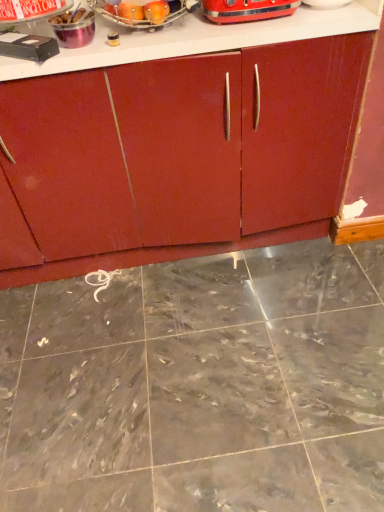
Question: From the image's perspective, relative to black plastic vcr at upper left, the 1th appliance viewed from the left, is metallic silver container at upper left, which ranks as the third appliance in right-to-left order, above or below?

Choices:
 (A) above
 (B) below

Answer: (A)

Question: In terms of width, does metallic silver container at upper left, which ranks as the third appliance in right-to-left order, look wider or thinner when compared to black plastic vcr at upper left, which ranks as the 5th appliance in right-to-left order?

Choices:
 (A) wide
 (B) thin

Answer: (A)

Question: Which object is the closest to the metallic silver fruit basket at upper center, the second appliance from the right?

Choices:
 (A) shiny metallic toaster at upper center, the fifth appliance when ordered from left to right
 (B) metallic silver toaster at upper center, which is counted as the fourth appliance, starting from the right
 (C) gray marble floor at center
 (D) matte wood cabinet at center
 (E) black plastic vcr at upper left, which ranks as the 5th appliance in right-to-left order

Answer: (A)

Question: Which object is the farthest from the metallic silver container at upper left, which ranks as the third appliance in right-to-left order?

Choices:
 (A) metallic silver fruit basket at upper center, the second appliance from the right
 (B) matte wood cabinet at center
 (C) black plastic vcr at upper left, which ranks as the 5th appliance in right-to-left order
 (D) metallic silver toaster at upper center, arranged as the second appliance when viewed from the left
 (E) shiny metallic toaster at upper center, arranged as the first appliance when viewed from the right

Answer: (B)